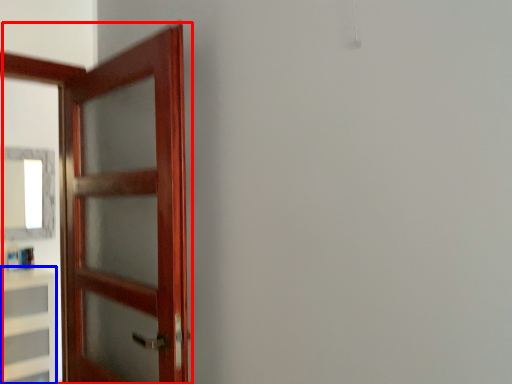
Question: Which object is further to the camera taking this photo, door (highlighted by a red box) or cabinetry (highlighted by a blue box)?

Choices:
 (A) door
 (B) cabinetry

Answer: (B)